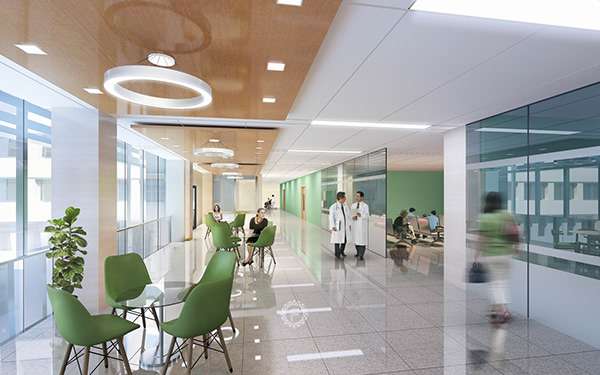
This screenshot has width=600, height=375. I want to click on floor, so [x=294, y=334].